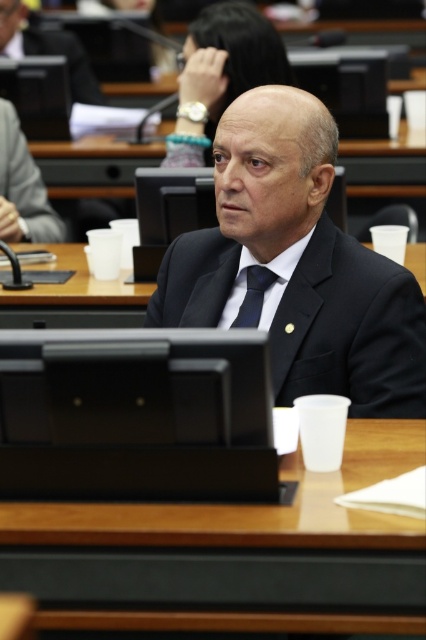
Question: Which point is closer to the camera?

Choices:
 (A) (371, 342)
 (B) (233, 321)
 (C) (80, 83)
 (D) (5, 115)

Answer: (A)

Question: Does black matte suit at center have a smaller size compared to matte black suit at center?

Choices:
 (A) yes
 (B) no

Answer: (B)

Question: Is matte black suit at center in front of black suit at center?

Choices:
 (A) yes
 (B) no

Answer: (A)

Question: Among these points, which one is nearest to the camera?

Choices:
 (A) (391, 435)
 (B) (74, 67)
 (C) (290, 353)
 (D) (55, 236)

Answer: (A)

Question: Is wooden table at center positioned behind black matte suit at center?

Choices:
 (A) yes
 (B) no

Answer: (B)

Question: Which is farther from the blue silk tie at center?

Choices:
 (A) black suit at center
 (B) matte black suit at center

Answer: (A)